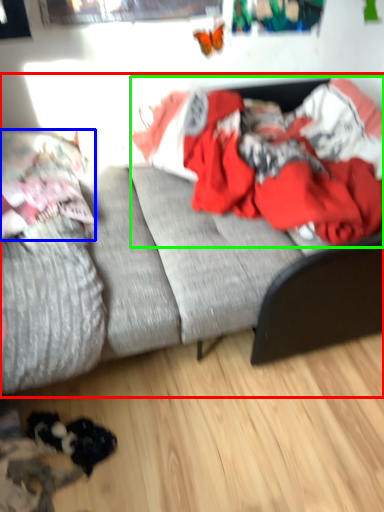
Question: Which is farther away from studio couch (highlighted by a red box)? pillow (highlighted by a blue box) or clothing (highlighted by a green box)?

Choices:
 (A) pillow
 (B) clothing

Answer: (A)